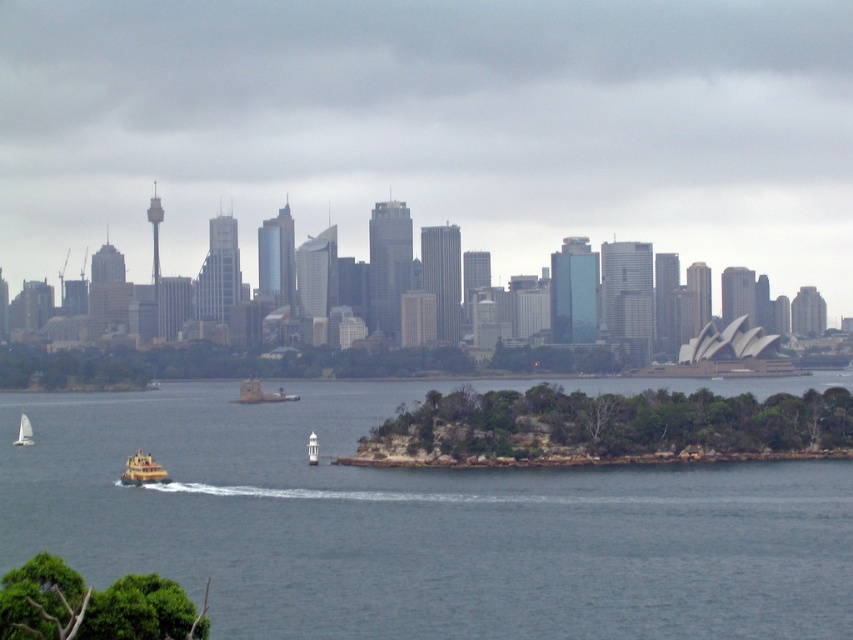
You are a photographer planning to capture a shot of the Sydney skyline with both the yellow matte boat at lower left and the white matte sailboat at lower left in the frame. Which boat should you focus on first to ensure it appears larger in the photo?

The yellow matte boat at lower left is closer to the viewer than the white matte sailboat at lower left, so focusing on it first will make it appear larger in the photo.

You are a photographer planning to capture both the yellow matte boat at lower left and the white matte sailboat at lower left in a single shot. Given their sizes, which boat should you focus on to ensure both fit in the frame without cropping?

The yellow matte boat at lower left is larger in size than the white matte sailboat at lower left, so you should focus on the larger yellow matte boat at lower left to ensure both fit in the frame without cropping.

You are standing at the camera position and want to visit the location marked by the point at coordinates (335, 200). If your walking speed is 5 km per hour, approximately how long will it take you to reach that point?

The point at coordinates (335, 200) is 658.19 meters from the camera. Converting meters to kilometers, that is 0.658 kilometers. At a walking speed of 5 km per hour, the time required would be 0.658 km divided by 5 km per hour, which equals approximately 0.1316 hours. Multiplying by 60 minutes gives roughly 7.9 minutes. Therefore, it will take about 8 minutes to reach the point.